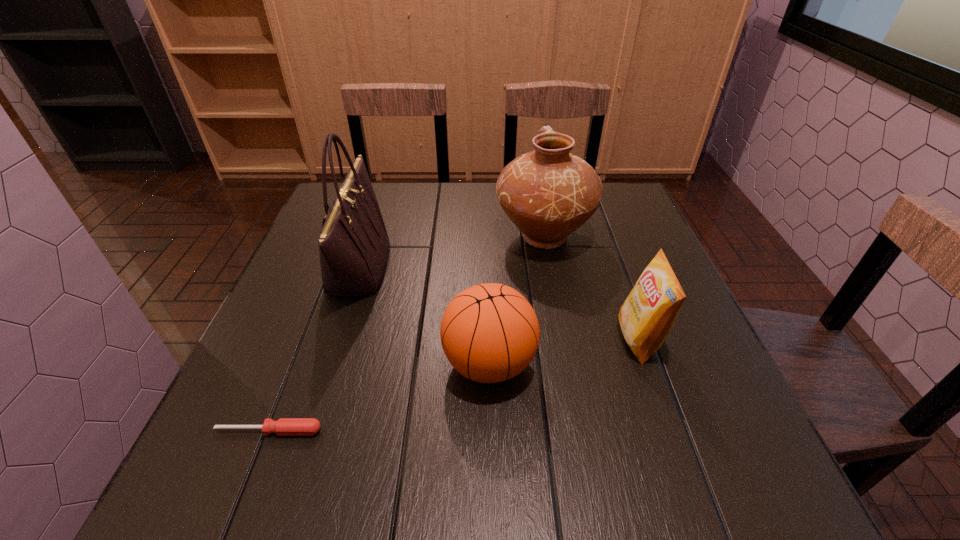
Locate an element on the screen. The width and height of the screenshot is (960, 540). vacant space situated on the front-facing side of the crisp (potato chip) is located at coordinates (461, 340).

At what (x,y) coordinates should I click in order to perform the action: click on blank space located on the front-facing side of the crisp (potato chip). Please return your answer as a coordinate pair (x, y). The height and width of the screenshot is (540, 960). Looking at the image, I should click on (520, 340).

Identify the location of free spot located on the front-facing side of the crisp (potato chip). This screenshot has width=960, height=540. (446, 340).

Identify the location of vacant point located 0.260m on the left of the basketball. (307, 363).

Identify the location of free spot located on the back of the screwdriver. This screenshot has width=960, height=540. (331, 272).

Find the location of `handbag that is at the far edge`. handbag that is at the far edge is located at coordinates (353, 244).

This screenshot has width=960, height=540. What are the coordinates of `pottery located in the far edge section of the desktop` in the screenshot? It's located at (548, 193).

Find the location of a particular element. handbag that is at the left edge is located at coordinates (353, 244).

Find the location of a particular element. This screenshot has height=540, width=960. screwdriver that is at the left edge is located at coordinates (284, 426).

Find the location of a particular element. This screenshot has height=540, width=960. pottery located in the right edge section of the desktop is located at coordinates point(548,193).